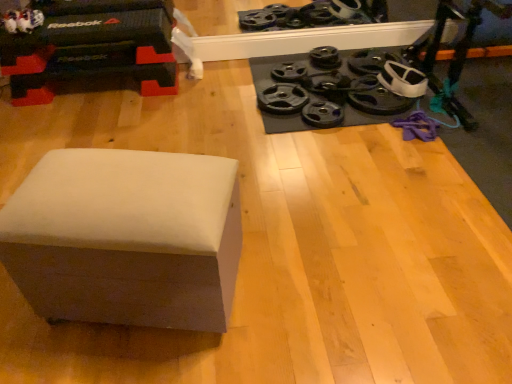
Locate an element on the screen. free space above white matte ottoman at lower left (from a real-world perspective) is located at coordinates (112, 176).